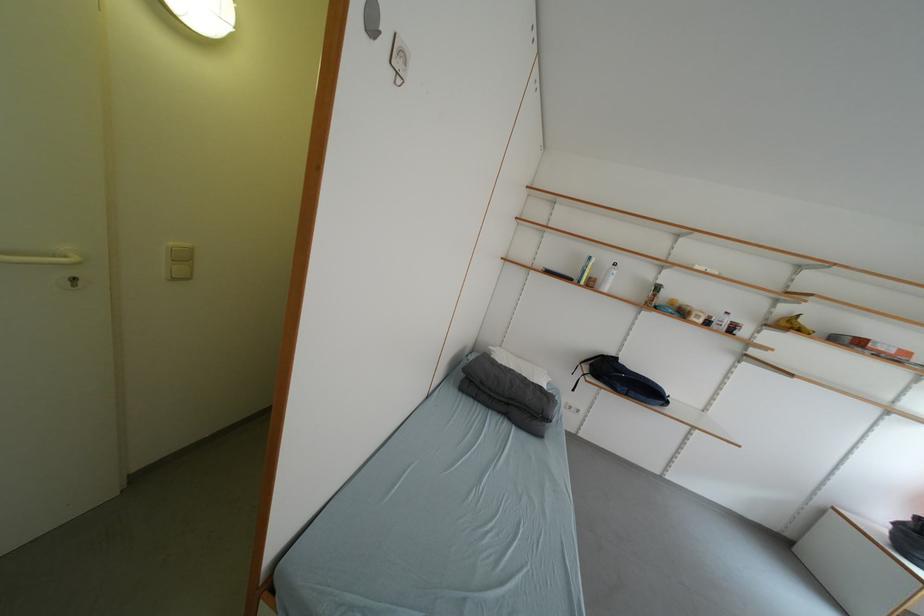
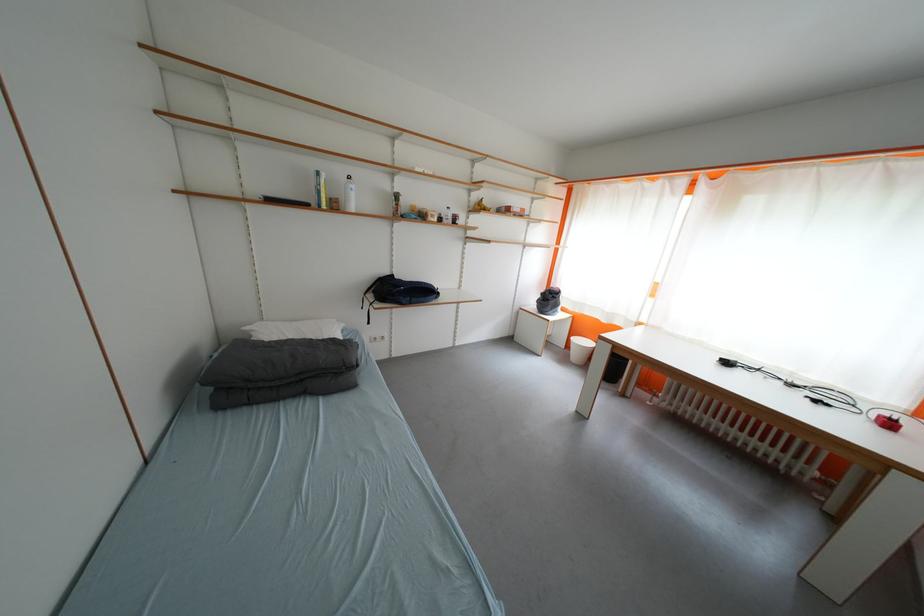
Find the pixel in the second image that matches (x=625, y=362) in the first image.

(400, 278)